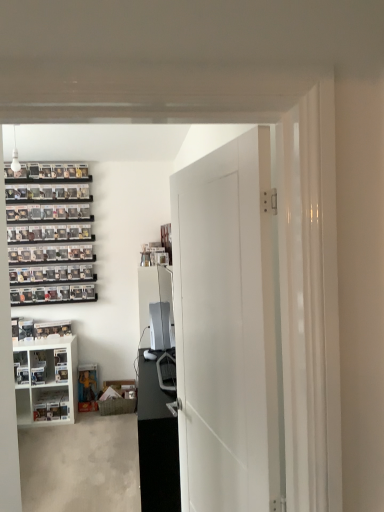
The width and height of the screenshot is (384, 512). What do you see at coordinates (157, 443) in the screenshot?
I see `black glossy entertainment center at center` at bounding box center [157, 443].

Find the location of `white matte door at center`. white matte door at center is located at coordinates (227, 328).

Identify the location of white glossy cabinet at lower left. The image size is (384, 512). (46, 380).

In order to click on black glossy entertainment center at center in this screenshot , I will do `click(157, 443)`.

Would you consider white glossy cabinet at lower left to be distant from white plastic shelf at lower left?

white glossy cabinet at lower left is actually quite close to white plastic shelf at lower left.

Could you tell me if white glossy cabinet at lower left is turned towards white plastic shelf at lower left?

No, white glossy cabinet at lower left is not turned towards white plastic shelf at lower left.

Identify the location of shelf below the white glossy cabinet at lower left (from the image's perspective). This screenshot has height=512, width=384. (51, 405).

Can you confirm if white glossy cabinet at lower left is smaller than white plastic shelf at lower left?

No.

Where is `cabinetry that is on the left side of white matte door at center`? cabinetry that is on the left side of white matte door at center is located at coordinates (46, 380).

Is point (235, 356) less distant than point (71, 348)?

That is True.

Would you say white glossy cabinet at lower left is part of white matte door at center's contents?

That's incorrect, white glossy cabinet at lower left is not inside white matte door at center.

Between black glossy entertainment center at center and white matte door at center, which one has less height?

With less height is black glossy entertainment center at center.

From a real-world perspective, which is physically above, black glossy entertainment center at center or white matte door at center?

white matte door at center.

Based on the photo, are black glossy entertainment center at center and white matte door at center far apart?

That's not correct — black glossy entertainment center at center is a little close to white matte door at center.

From the image's perspective, which one is positioned higher, black glossy entertainment center at center or white matte door at center?

white matte door at center is shown above in the image.

Can you confirm if black glossy entertainment center at center is positioned to the right of white glossy cabinet at lower left?

Yes.

Looking at their sizes, would you say black glossy entertainment center at center is wider or thinner than white glossy cabinet at lower left?

black glossy entertainment center at center is thinner than white glossy cabinet at lower left.

Is black glossy entertainment center at center oriented away from white glossy cabinet at lower left?

No.

Is point (255, 448) closer or farther from the camera than point (164, 426)?

Point (255, 448) is closer to the camera than point (164, 426).

From a real-world perspective, is white matte door at center located beneath black glossy entertainment center at center?

No, from a real-world perspective, white matte door at center is not beneath black glossy entertainment center at center.

From the image's perspective, is white matte door at center above or below black glossy entertainment center at center?

From the image's perspective, white matte door at center appears above black glossy entertainment center at center.

Could you tell me if white matte door at center is facing black glossy entertainment center at center?

No.

Is white plastic shelf at lower left next to white glossy cabinet at lower left?

white plastic shelf at lower left and white glossy cabinet at lower left are not in contact.

Identify the location of cabinetry in front of the white plastic shelf at lower left. This screenshot has width=384, height=512. (46, 380).

Is white glossy cabinet at lower left behind black glossy entertainment center at center?

Yes, it is.

Is white glossy cabinet at lower left wider or thinner than black glossy entertainment center at center?

In the image, white glossy cabinet at lower left appears to be wider than black glossy entertainment center at center.

In the scene shown: Is white glossy cabinet at lower left far from black glossy entertainment center at center?

Yes, white glossy cabinet at lower left and black glossy entertainment center at center are located far from each other.

Does white glossy cabinet at lower left have a larger size compared to black glossy entertainment center at center?

No, white glossy cabinet at lower left is not bigger than black glossy entertainment center at center.

In the image, there is a white plastic shelf at lower left. Identify the location of cabinetry above it (from the image's perspective). (46, 380).

The width and height of the screenshot is (384, 512). In order to click on cabinetry below the white matte door at center (from the image's perspective) in this screenshot , I will do `click(46, 380)`.

Considering their positions, is black glossy entertainment center at center positioned further to white matte door at center than white plastic shelf at lower left?

white plastic shelf at lower left.

Considering their positions, is white glossy cabinet at lower left positioned further to black glossy entertainment center at center than white plastic shelf at lower left?

Among the two, white glossy cabinet at lower left is located further to black glossy entertainment center at center.

Which object lies further to the anchor point white plastic shelf at lower left, white matte door at center or white glossy cabinet at lower left?

white matte door at center lies further to white plastic shelf at lower left than the other object.

Considering their positions, is white glossy cabinet at lower left positioned closer to white plastic shelf at lower left than black glossy entertainment center at center?

white glossy cabinet at lower left is closer to white plastic shelf at lower left.

Estimate the real-world distances between objects in this image. Which object is closer to black glossy entertainment center at center, white plastic shelf at lower left or white glossy cabinet at lower left?

white plastic shelf at lower left is positioned closer to the anchor black glossy entertainment center at center.

Considering their positions, is black glossy entertainment center at center positioned closer to white plastic shelf at lower left than white glossy cabinet at lower left?

white glossy cabinet at lower left is closer to white plastic shelf at lower left.

From the image, which object appears to be nearer to white matte door at center, white glossy cabinet at lower left or black glossy entertainment center at center?

black glossy entertainment center at center is positioned closer to the anchor white matte door at center.

Which object lies further to the anchor point white glossy cabinet at lower left, white plastic shelf at lower left or white matte door at center?

white matte door at center is further to white glossy cabinet at lower left.

Locate an element on the screen. Image resolution: width=384 pixels, height=512 pixels. cabinetry between black glossy entertainment center at center and white plastic shelf at lower left along the z-axis is located at coordinates (46, 380).

Where is `cabinetry located between white matte door at center and white plastic shelf at lower left in the depth direction`? This screenshot has height=512, width=384. cabinetry located between white matte door at center and white plastic shelf at lower left in the depth direction is located at coordinates (46, 380).

This screenshot has height=512, width=384. What are the coordinates of `entertainment center located between white matte door at center and white glossy cabinet at lower left in the depth direction` in the screenshot? It's located at (157, 443).

The height and width of the screenshot is (512, 384). In order to click on entertainment center located between white matte door at center and white plastic shelf at lower left in the depth direction in this screenshot , I will do `click(157, 443)`.